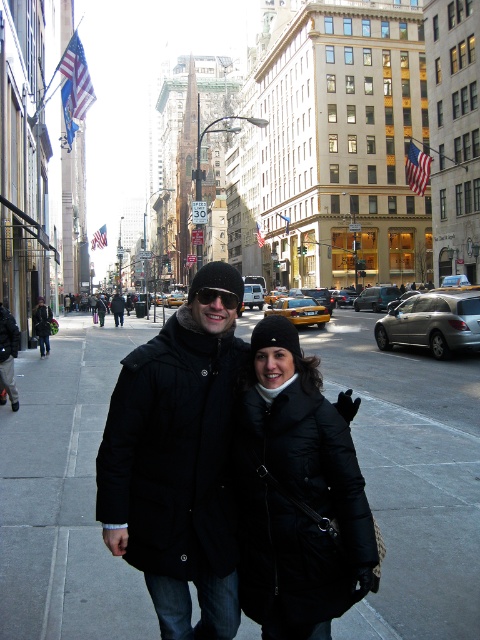
Question: Is matte black coat at center positioned at the back of sunglasses at center?

Choices:
 (A) yes
 (B) no

Answer: (B)

Question: Among these objects, which one is nearest to the camera?

Choices:
 (A) sunglasses at center
 (B) black puffy coat at center

Answer: (B)

Question: Can you confirm if sunglasses at center is positioned above black matte jacket at center?

Choices:
 (A) yes
 (B) no

Answer: (B)

Question: Based on their relative distances, which object is nearer to the black matte jacket at center?

Choices:
 (A) matte black coat at center
 (B) sunglasses at center

Answer: (A)

Question: Which object is farther from the camera taking this photo?

Choices:
 (A) sunglasses at center
 (B) matte black coat at center

Answer: (A)

Question: Is matte black coat at center behind black matte jacket at center?

Choices:
 (A) yes
 (B) no

Answer: (B)